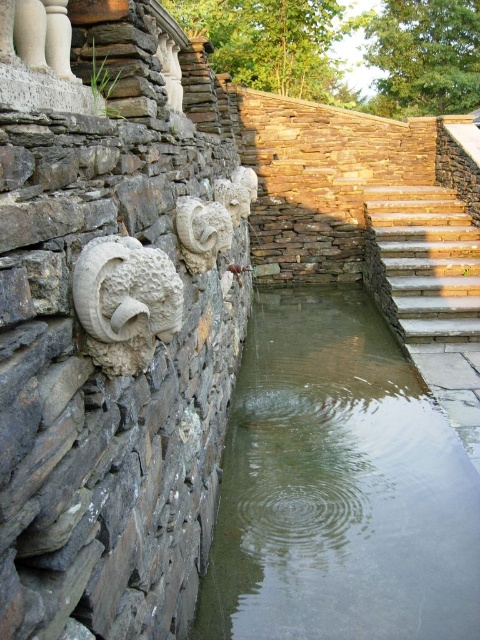
Between clear glass water at center and gray stone ram head at left, which one is positioned lower?

clear glass water at center

Which is more to the right, clear glass water at center or gray stone ram head at left?

clear glass water at center

Which is behind, point (470, 536) or point (126, 282)?

The point (470, 536) is behind.

Identify the location of clear glass water at center. The height and width of the screenshot is (640, 480). (338, 486).

What are the coordinates of `stone stairs at upper right` in the screenshot? It's located at (422, 262).

Who is positioned more to the left, stone stairs at upper right or gray stone ram head at left?

gray stone ram head at left

Find the location of `stone stairs at upper right`. stone stairs at upper right is located at coordinates (422, 262).

You are a GUI agent. You are given a task and a screenshot of the screen. Output one action in this format:
    pyautogui.click(x=<x>, y=<y>)
    Task: Click on the stone stairs at upper right
    Image resolution: width=480 pixels, height=640 pixels.
    Given the screenshot: What is the action you would take?
    pyautogui.click(x=422, y=262)

Does gray stone ram head at left appear on the left side of white stone ram at center?

Indeed, gray stone ram head at left is positioned on the left side of white stone ram at center.

Does gray stone ram head at left lie behind white stone ram at center?

No, gray stone ram head at left is in front of white stone ram at center.

Who is more distant from viewer, (157, 260) or (203, 257)?

The point (203, 257) is more distant.

Locate an element on the screen. The width and height of the screenshot is (480, 640). gray stone ram head at left is located at coordinates (126, 301).